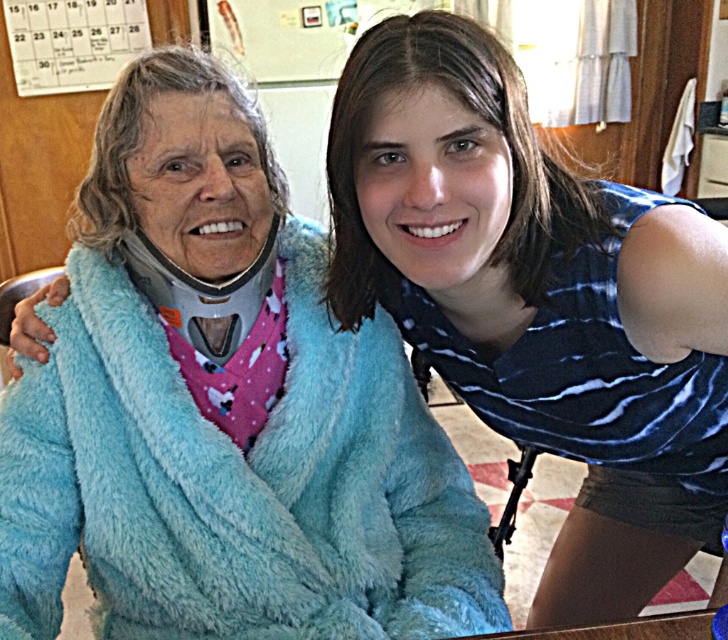
You are helping organize a clothing donation drive. You have two blue fuzzy bathrobes to sort. The blue fuzzy bathrobe at left and the blue fuzzy bathrobe at right. Based on their sizes, which one should be placed in the adult section and which in the children section?

The blue fuzzy bathrobe at left has a smaller size compared to the blue fuzzy bathrobe at right. Therefore, the blue fuzzy bathrobe at left should be placed in the children section and the blue fuzzy bathrobe at right in the adult section.

You are a fashion designer observing two people in a kitchen. You notice the blue fuzzy bathrobe at left and the blue fuzzy bathrobe at right. Which one is closer to the bottom edge of the image?

The blue fuzzy bathrobe at left is positioned under the blue fuzzy bathrobe at right, meaning it is closer to the bottom edge of the image.